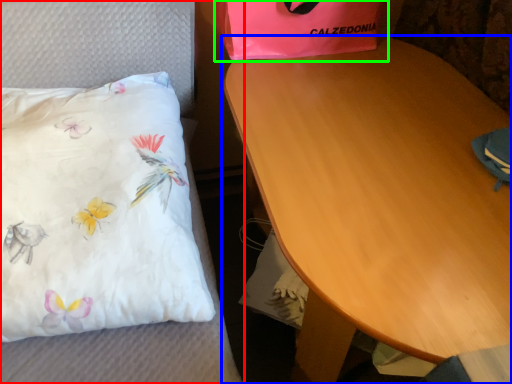
Question: Based on their relative distances, which object is nearer to furniture (highlighted by a red box)? Choose from table (highlighted by a blue box) and gift bag (highlighted by a green box).

Choices:
 (A) table
 (B) gift bag

Answer: (B)